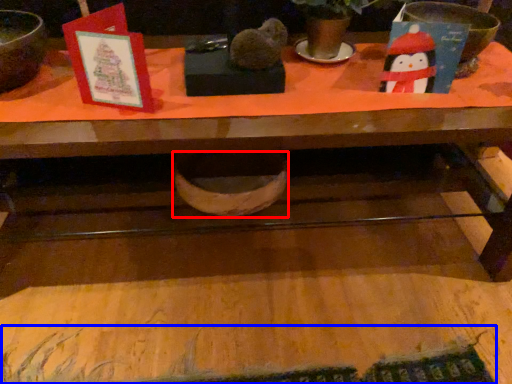
Question: Which object appears farthest to the camera in this image, basin (highlighted by a red box) or writing (highlighted by a blue box)?

Choices:
 (A) basin
 (B) writing

Answer: (A)